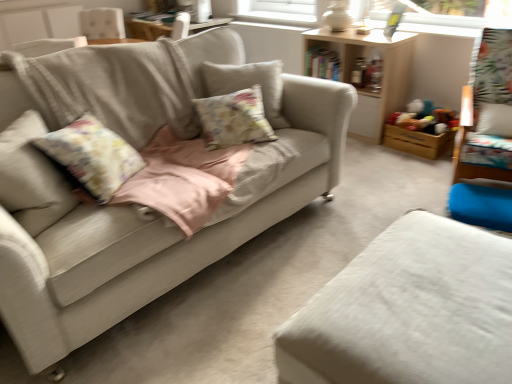
At what (x,y) coordinates should I click in order to perform the action: click on vacant space that is to the left of wooden swivel chair at right. Please return your answer as a coordinate pair (x, y). Image resolution: width=512 pixels, height=384 pixels. Looking at the image, I should click on (393, 181).